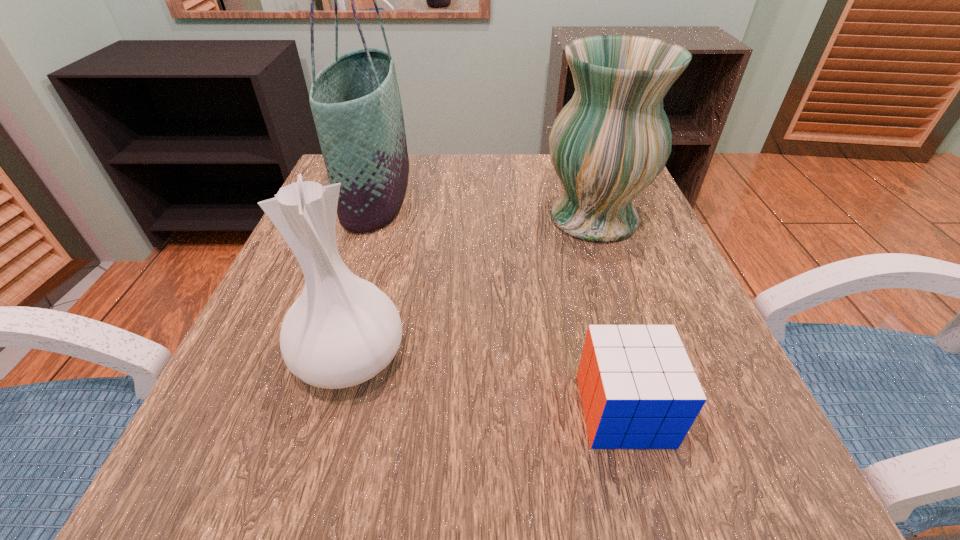
Locate an element on the screen. Image resolution: width=960 pixels, height=540 pixels. tote bag is located at coordinates (355, 101).

Locate an element on the screen. This screenshot has width=960, height=540. the farther vase is located at coordinates (612, 139).

Where is `the nearer vase`? This screenshot has width=960, height=540. the nearer vase is located at coordinates (342, 330).

The image size is (960, 540). What are the coordinates of `the shorter vase` in the screenshot? It's located at (342, 330).

Locate an element on the screen. the shortest object is located at coordinates (638, 389).

At what (x,y) coordinates should I click in order to perform the action: click on vacant space located 0.380m on the front of the tallest object. Please return your answer as a coordinate pair (x, y). The width and height of the screenshot is (960, 540). Looking at the image, I should click on (307, 400).

At what (x,y) coordinates should I click in order to perform the action: click on vacant space situated on the left of the right vase. Please return your answer as a coordinate pair (x, y). The height and width of the screenshot is (540, 960). Looking at the image, I should click on (499, 218).

I want to click on vacant space located 0.290m on the back of the nearer vase, so click(x=388, y=218).

Locate an element on the screen. vacant area located on the back of the cube is located at coordinates (596, 307).

Locate an element on the screen. tote bag at the far edge is located at coordinates (355, 101).